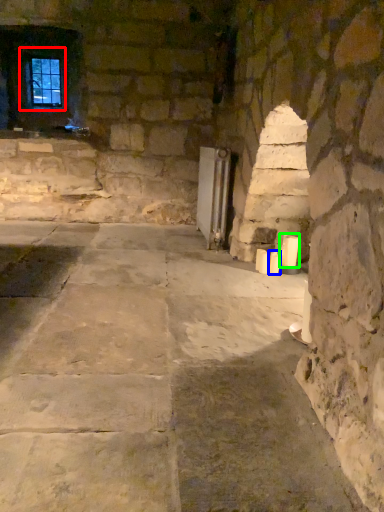
Question: Which is nearer to the window (highlighted by a red box)? candle (highlighted by a blue box) or candle (highlighted by a green box).

Choices:
 (A) candle
 (B) candle

Answer: (B)